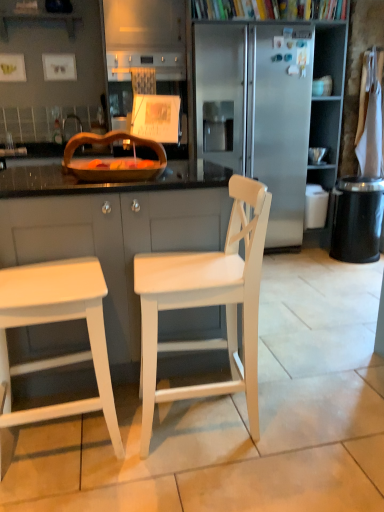
Question: Can you confirm if stainless steel refrigerator at center is thinner than wooden tray at center?

Choices:
 (A) yes
 (B) no

Answer: (B)

Question: From the image's perspective, is stainless steel refrigerator at center below wooden tray at center?

Choices:
 (A) yes
 (B) no

Answer: (B)

Question: From a real-world perspective, is stainless steel refrigerator at center on wooden tray at center?

Choices:
 (A) no
 (B) yes

Answer: (B)

Question: Can you confirm if stainless steel refrigerator at center is taller than wooden tray at center?

Choices:
 (A) no
 (B) yes

Answer: (B)

Question: Does stainless steel refrigerator at center lie behind wooden tray at center?

Choices:
 (A) yes
 (B) no

Answer: (A)

Question: Considering their positions, is black textured trash can at right located in front of or behind white matte chair at center?

Choices:
 (A) behind
 (B) front

Answer: (A)

Question: Do you think black textured trash can at right is within white matte chair at center, or outside of it?

Choices:
 (A) outside
 (B) inside

Answer: (A)

Question: In terms of height, does black textured trash can at right look taller or shorter compared to white matte chair at center?

Choices:
 (A) short
 (B) tall

Answer: (A)

Question: From the image's perspective, is black textured trash can at right positioned above or below white matte chair at center?

Choices:
 (A) above
 (B) below

Answer: (A)

Question: Is black textured trash can at right bigger or smaller than stainless steel refrigerator at center?

Choices:
 (A) big
 (B) small

Answer: (B)

Question: In the image, is black textured trash can at right positioned in front of or behind stainless steel refrigerator at center?

Choices:
 (A) behind
 (B) front

Answer: (A)

Question: From their relative heights in the image, would you say black textured trash can at right is taller or shorter than stainless steel refrigerator at center?

Choices:
 (A) tall
 (B) short

Answer: (B)

Question: Is black textured trash can at right to the left or to the right of stainless steel refrigerator at center in the image?

Choices:
 (A) right
 (B) left

Answer: (A)

Question: In terms of size, does stainless steel refrigerator at center appear bigger or smaller than white matte stool at left?

Choices:
 (A) big
 (B) small

Answer: (A)

Question: Is stainless steel refrigerator at center situated inside white matte stool at left or outside?

Choices:
 (A) outside
 (B) inside

Answer: (A)